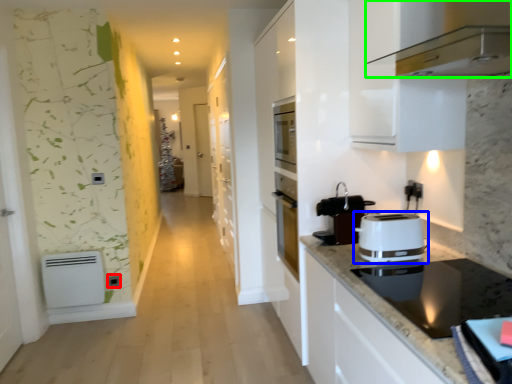
Question: Estimate the real-world distances between objects in this image. Which object is farther from electric outlet (highlighted by a red box), toaster (highlighted by a blue box) or home appliance (highlighted by a green box)?

Choices:
 (A) toaster
 (B) home appliance

Answer: (B)